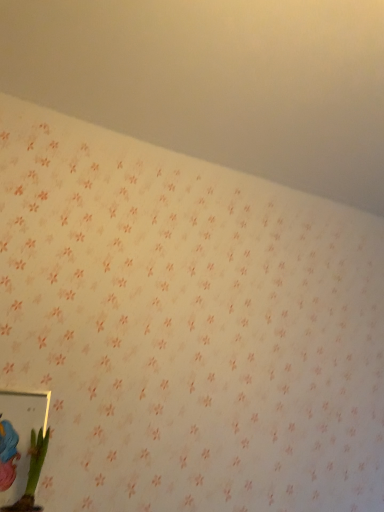
The image size is (384, 512). What do you see at coordinates (22, 447) in the screenshot?
I see `wooden picture frame at lower left` at bounding box center [22, 447].

Find the location of a particular element. This screenshot has height=512, width=384. wooden picture frame at lower left is located at coordinates (22, 447).

Locate an element on the screen. Image resolution: width=384 pixels, height=512 pixels. wooden picture frame at lower left is located at coordinates (22, 447).